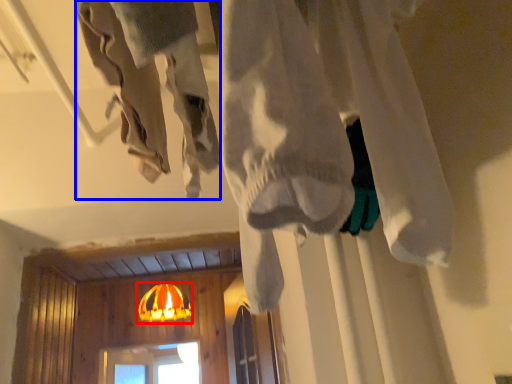
Question: Which object appears farthest to the camera in this image, lamp (highlighted by a red box) or clothing (highlighted by a blue box)?

Choices:
 (A) lamp
 (B) clothing

Answer: (A)